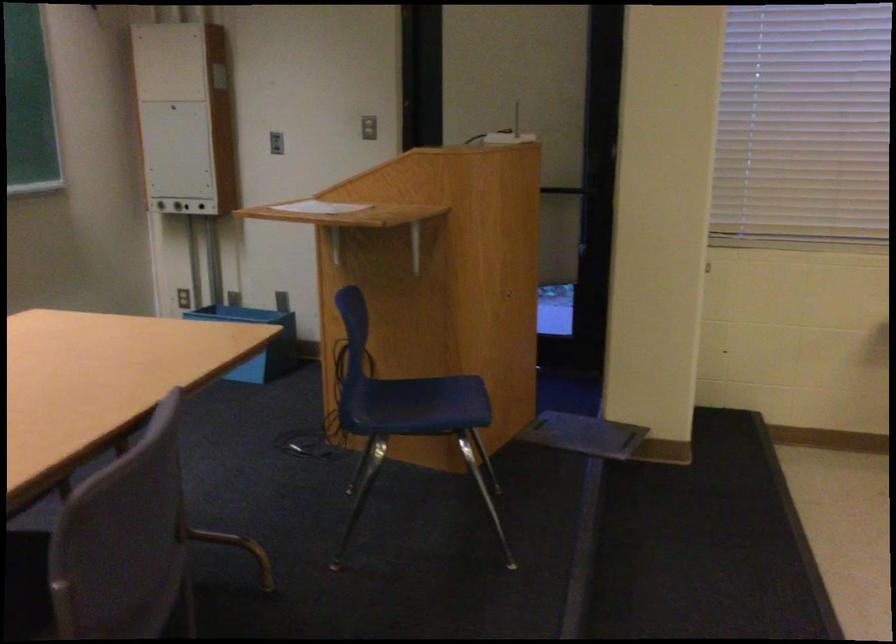
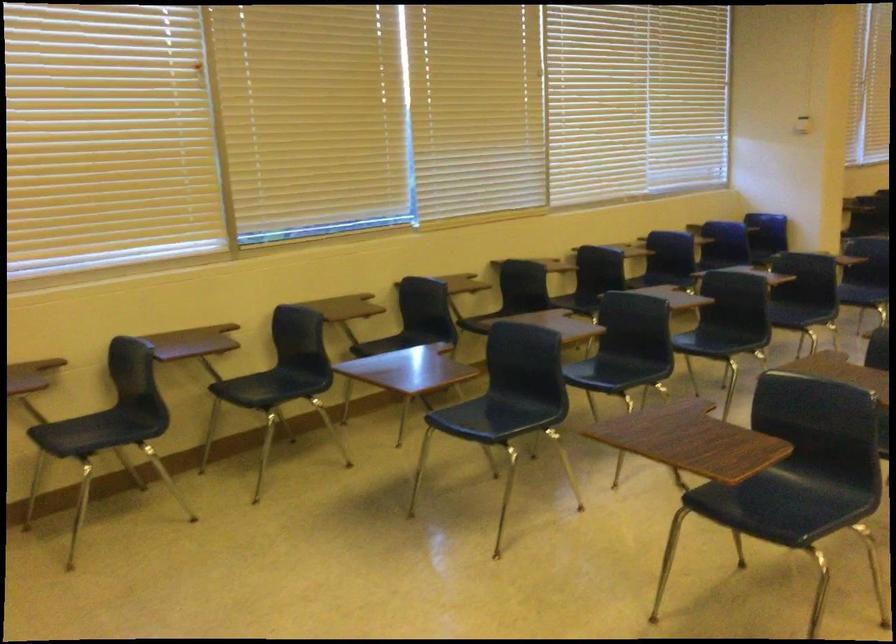
Question: The camera is either moving clockwise (left) or counter-clockwise (right) around the object. The first image is from the beginning of the video and the second image is from the end. Is the camera moving left or right when shooting the video?

Choices:
 (A) Left
 (B) Right

Answer: (A)